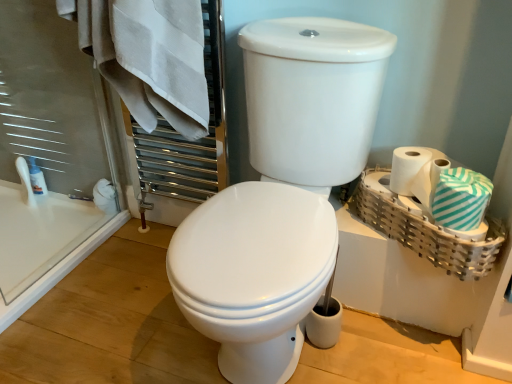
Find the location of `free point below white cotton towel at upper left, the second bath towel from the right (from a real-world perspective)`. free point below white cotton towel at upper left, the second bath towel from the right (from a real-world perspective) is located at coordinates (129, 244).